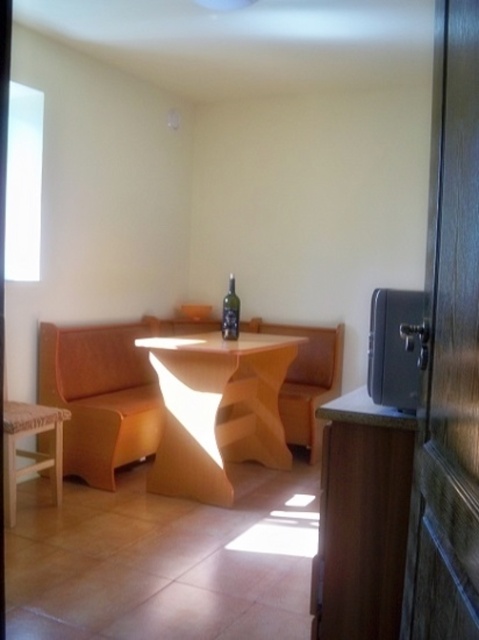
Question: Which of the following is the closest to the observer?

Choices:
 (A) orange fabric armchair at left
 (B) green glass bottle at center
 (C) wooden stool at lower left

Answer: (C)

Question: Which is nearer to the wooden armchair at center?

Choices:
 (A) orange fabric armchair at left
 (B) matte orange table at center

Answer: (B)

Question: Which point appears closest to the camera in this image?

Choices:
 (A) (289, 458)
 (B) (117, 390)
 (C) (234, 314)

Answer: (C)

Question: Does orange fabric armchair at left appear on the left side of wooden armchair at center?

Choices:
 (A) no
 (B) yes

Answer: (B)

Question: Can you confirm if matte orange table at center is positioned to the left of orange fabric armchair at left?

Choices:
 (A) no
 (B) yes

Answer: (A)

Question: Does matte orange table at center have a lesser width compared to orange fabric armchair at left?

Choices:
 (A) no
 (B) yes

Answer: (A)